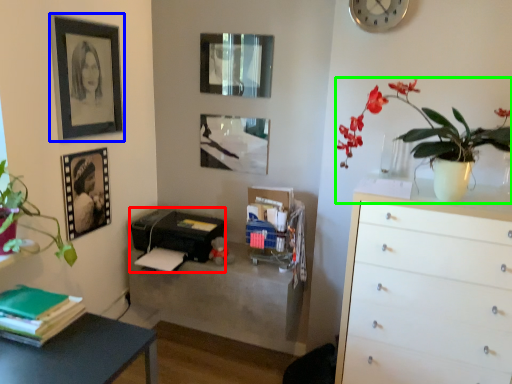
Question: Estimate the real-world distances between objects in this image. Which object is closer to printer (highlighted by a red box), picture frame (highlighted by a blue box) or flower (highlighted by a green box)?

Choices:
 (A) picture frame
 (B) flower

Answer: (A)